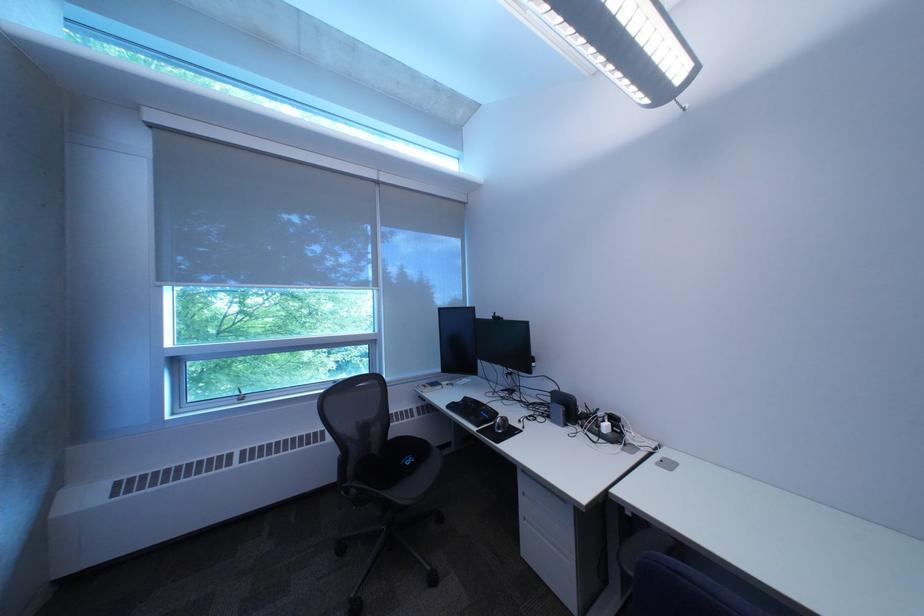
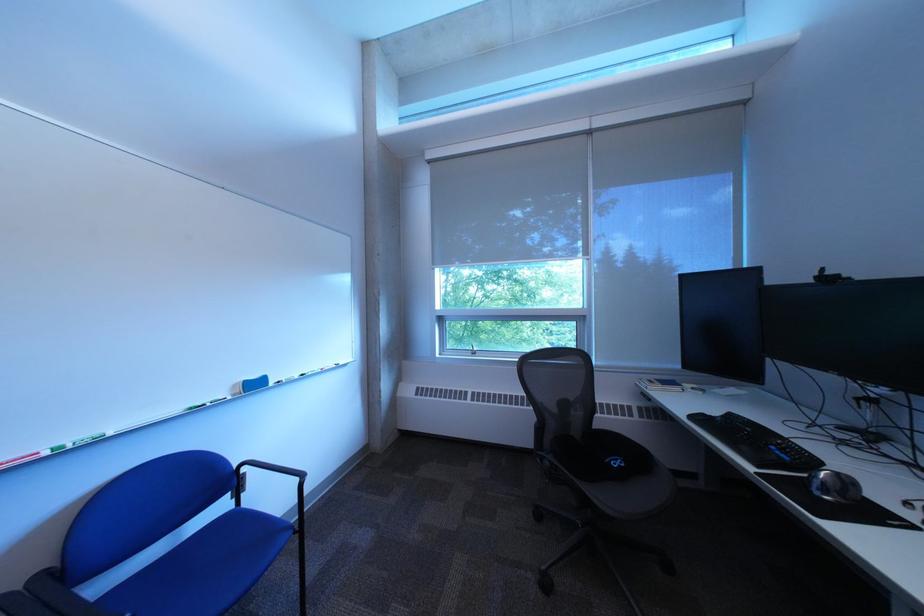
Where in the second image is the point corresponding to pixel 464 408 from the first image?

(708, 419)